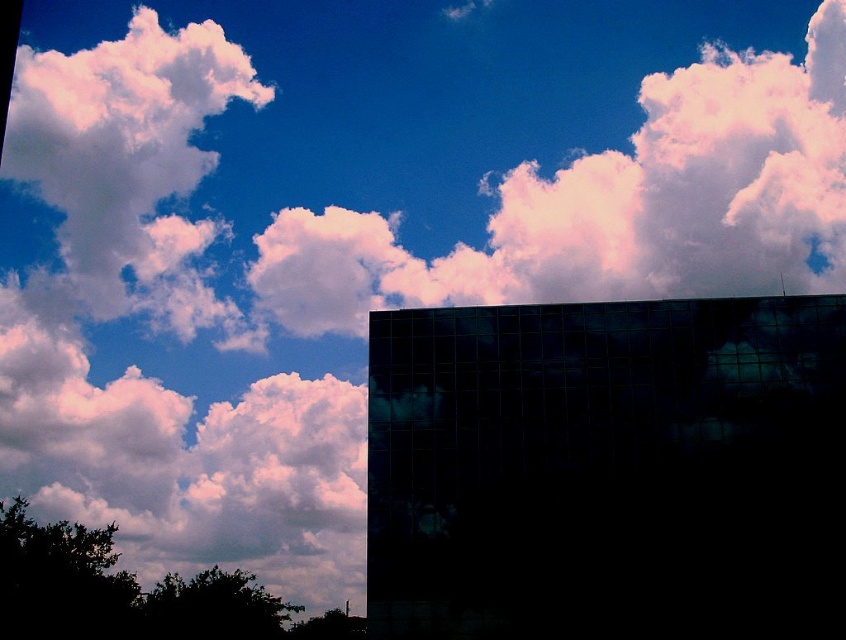
Question: Which point is closer to the camera taking this photo?

Choices:
 (A) (827, 161)
 (B) (53, 83)

Answer: (A)

Question: Considering the relative positions of white fluffy cloud at upper center and white fluffy cloud at upper left in the image provided, where is white fluffy cloud at upper center located with respect to white fluffy cloud at upper left?

Choices:
 (A) left
 (B) right

Answer: (B)

Question: Does white fluffy cloud at upper center have a smaller size compared to white fluffy cloud at upper left?

Choices:
 (A) yes
 (B) no

Answer: (B)

Question: Can you confirm if white fluffy cloud at upper center is positioned to the left of white fluffy cloud at upper left?

Choices:
 (A) no
 (B) yes

Answer: (A)

Question: Which point is closer to the camera?

Choices:
 (A) (207, 80)
 (B) (816, 106)

Answer: (A)

Question: Which point is closer to the camera?

Choices:
 (A) (152, 204)
 (B) (530, 260)

Answer: (B)